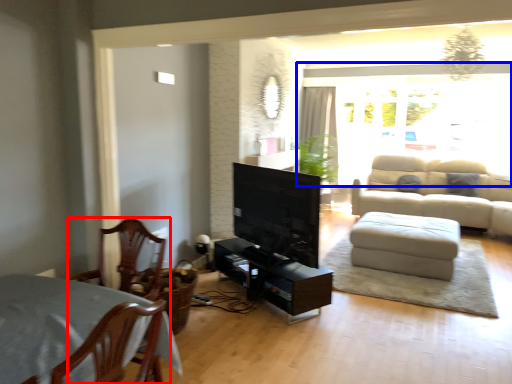
Question: Which object is further to the camera taking this photo, chair (highlighted by a red box) or window (highlighted by a blue box)?

Choices:
 (A) chair
 (B) window

Answer: (B)